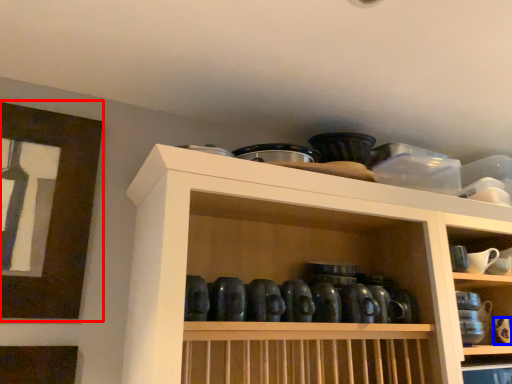
Question: Which object is further to the camera taking this photo, picture frame (highlighted by a red box) or tableware (highlighted by a blue box)?

Choices:
 (A) picture frame
 (B) tableware

Answer: (B)